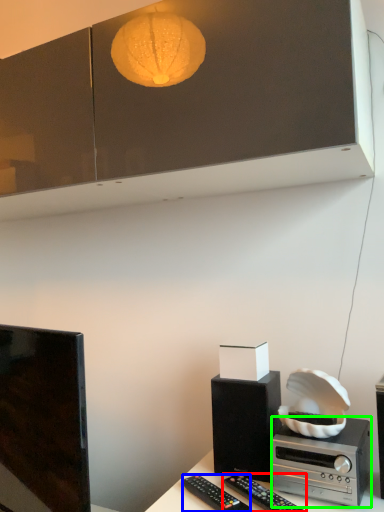
Question: Which is farther away from remote control (highlighted by a red box)? remote control (highlighted by a blue box) or stereo (highlighted by a green box)?

Choices:
 (A) remote control
 (B) stereo

Answer: (B)